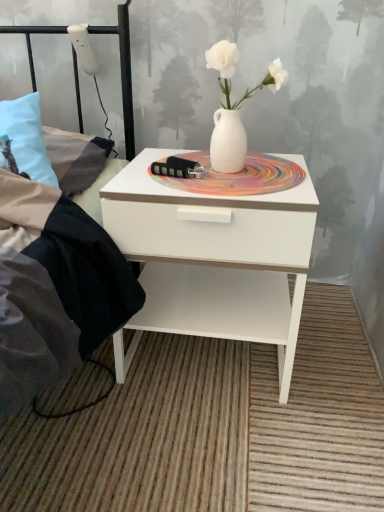
Find the location of a particular element. The image size is (384, 512). free space in front of white glossy nightstand at center is located at coordinates (202, 449).